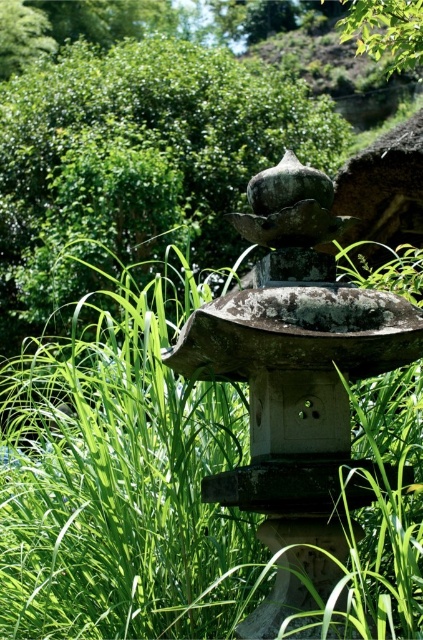
You are standing 10 feet away from the camera position. You want to walk towards the green grass at center. How many more feet do you need to walk to reach it?

The green grass at center is 18.51 feet away from the camera. Since you are already 10 feet away from the camera, you need to walk an additional 8.51 feet to reach it.

You are a gardener trying to maintain the traditional stone lantern. You notice the green grass at center and the green leafy bush at upper center. Which object is closer to the lantern?

The green grass at center is closer to the lantern because it is in front of the green leafy bush at upper center.

You are a gardener who needs to trim the green grass at center and the green leafy bush at upper center. Which of these two plants requires more trimming because it is taller?

The green leafy bush at upper center requires more trimming because it is taller than the green grass at center.